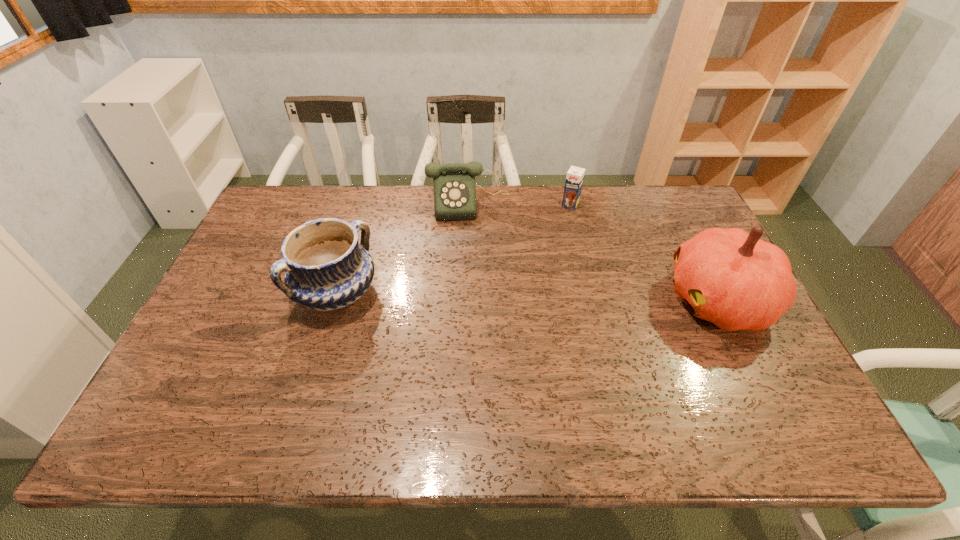
Image resolution: width=960 pixels, height=540 pixels. What are the coordinates of `free space on the desktop that is between the pottery and the rightmost object and is positioned on the dial of the telephone` in the screenshot? It's located at (476, 296).

At what (x,y) coordinates should I click in order to perform the action: click on vacant space on the desktop that is between the leftmost object and the pumpkin and is positioned on the front label of the third object from left to right. Please return your answer as a coordinate pair (x, y). Looking at the image, I should click on (516, 296).